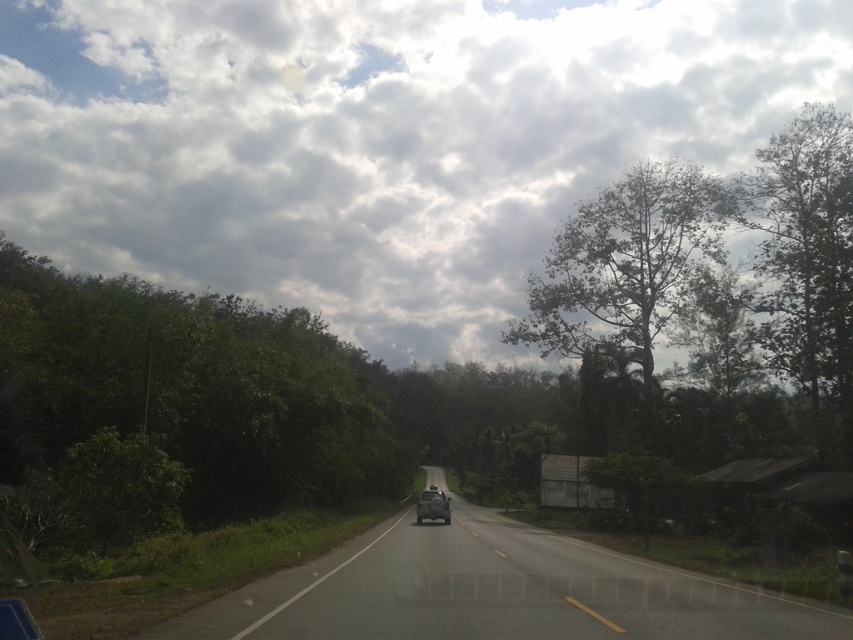
Does point (379, 403) come behind point (428, 490)?

No, (379, 403) is closer to viewer.

Who is positioned more to the right, green leafy bush at left or matte black motorcycle at center?

matte black motorcycle at center is more to the right.

You are a GUI agent. You are given a task and a screenshot of the screen. Output one action in this format:
    pyautogui.click(x=<x>, y=<y>)
    Task: Click on the green leafy bush at left
    The image size is (853, 640).
    Given the screenshot: What is the action you would take?
    pyautogui.click(x=173, y=410)

Is green leafy tree at right below shiny silver car at center?

Actually, green leafy tree at right is above shiny silver car at center.

Can you confirm if green leafy tree at right is shorter than shiny silver car at center?

Incorrect, green leafy tree at right's height does not fall short of shiny silver car at center's.

Locate an element on the screen. green leafy tree at right is located at coordinates (805, 257).

Which is above, green leafy tree at upper right or shiny silver car at center?

green leafy tree at upper right is above.

Who is more forward, (651, 308) or (438, 502)?

Positioned in front is point (438, 502).

Image resolution: width=853 pixels, height=640 pixels. I want to click on green leafy tree at upper right, so click(624, 276).